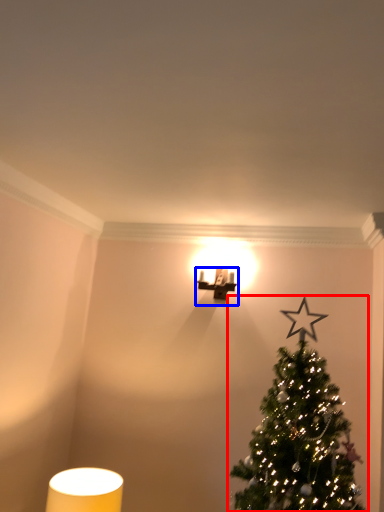
Question: Which point is closer to the camera, christmas tree (highlighted by a red box) or table lamp (highlighted by a blue box)?

Choices:
 (A) christmas tree
 (B) table lamp

Answer: (A)